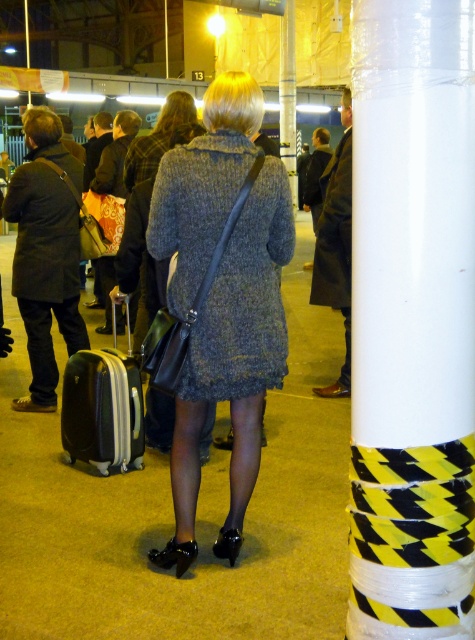
Question: Which point is farther from the camera taking this photo?

Choices:
 (A) (376, 184)
 (B) (184, 300)
 (C) (100, 413)
 (D) (282, 150)

Answer: (D)

Question: Is black hardshell suitcase at lower left to the right of white plastic pole at upper center from the viewer's perspective?

Choices:
 (A) yes
 (B) no

Answer: (B)

Question: Is knitted wool dress at center thinner than white plastic pole at upper center?

Choices:
 (A) no
 (B) yes

Answer: (B)

Question: Which of the following is the closest to the observer?

Choices:
 (A) (462, 140)
 (B) (282, 115)

Answer: (A)

Question: Which object appears closest to the camera in this image?

Choices:
 (A) white plastic pole at upper center
 (B) black hardshell suitcase at lower left
 (C) knitted wool dress at center

Answer: (C)

Question: Is knitted wool dress at center further to camera compared to white plastic pole at upper center?

Choices:
 (A) yes
 (B) no

Answer: (B)